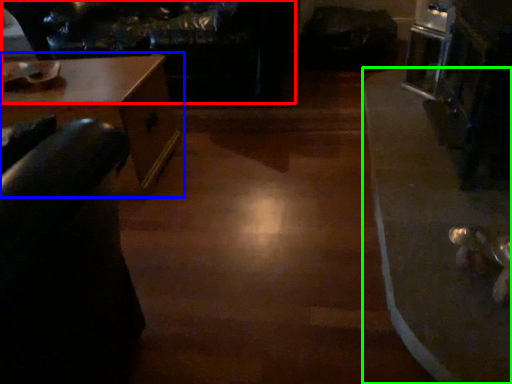
Question: Considering the real-world distances, which object is closest to couch (highlighted by a red box)? table (highlighted by a blue box) or table (highlighted by a green box).

Choices:
 (A) table
 (B) table

Answer: (A)